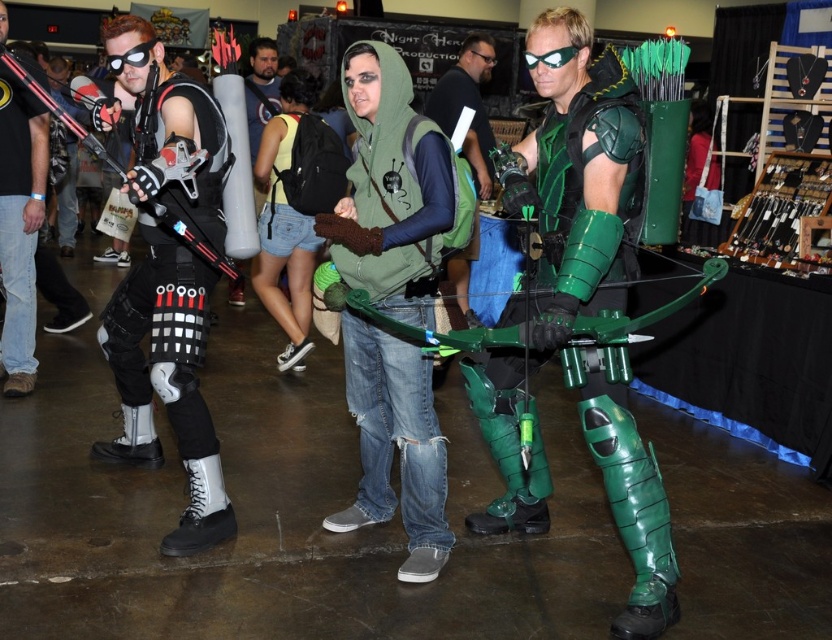
Does green matte armor at center lie behind green knitted vest at center?

No, it is in front of green knitted vest at center.

Can you confirm if green matte armor at center is smaller than green knitted vest at center?

Incorrect, green matte armor at center is not smaller in size than green knitted vest at center.

Measure the distance between point (548, 172) and camera.

Point (548, 172) and camera are 2.70 meters apart from each other.

Locate an element on the screen. green matte armor at center is located at coordinates (560, 240).

Which is more to the right, green knitted vest at center or black leather boots at left?

From the viewer's perspective, green knitted vest at center appears more on the right side.

Is green knitted vest at center positioned in front of black leather boots at left?

No, it is not.

Image resolution: width=832 pixels, height=640 pixels. What do you see at coordinates (390, 189) in the screenshot?
I see `green knitted vest at center` at bounding box center [390, 189].

This screenshot has height=640, width=832. Find the location of `green knitted vest at center`. green knitted vest at center is located at coordinates (390, 189).

Does green matte armor at center have a smaller size compared to black leather boots at left?

Yes.

Which is more to the left, green matte armor at center or black leather boots at left?

black leather boots at left

This screenshot has height=640, width=832. I want to click on green matte armor at center, so click(560, 240).